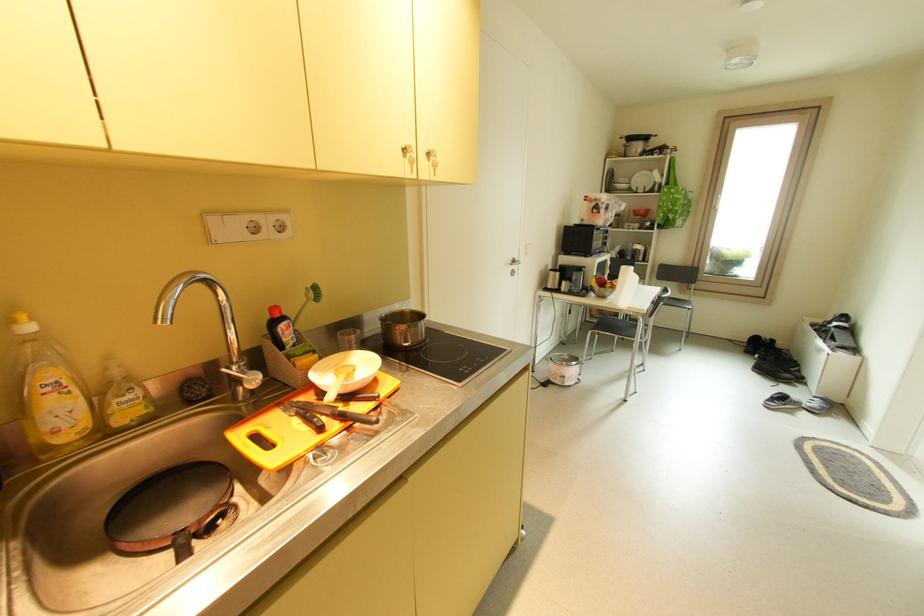
The width and height of the screenshot is (924, 616). Find the location of `white door handle`. white door handle is located at coordinates [514, 262].